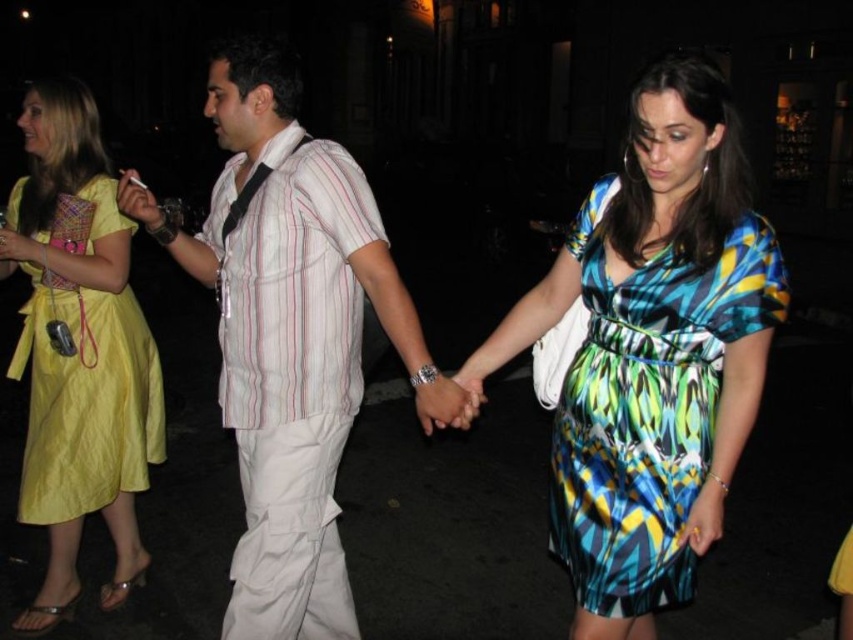
Question: Considering the real-world distances, which object is closest to the matte black cigarette at center?

Choices:
 (A) printed silk dress at center
 (B) white striped shirt at center

Answer: (B)

Question: In this image, where is printed silk dress at center located relative to matte black cigarette at center?

Choices:
 (A) above
 (B) below

Answer: (B)

Question: Based on their relative distances, which object is nearer to the printed silk dress at center?

Choices:
 (A) matte black cigarette at center
 (B) white striped shirt at center
 (C) yellow satin dress at left

Answer: (B)

Question: Does white striped shirt at center come in front of printed silk dress at center?

Choices:
 (A) yes
 (B) no

Answer: (B)

Question: Which point is farther to the camera?

Choices:
 (A) yellow satin dress at left
 (B) printed silk dress at center

Answer: (A)

Question: Observing the image, what is the correct spatial positioning of printed silk dress at center in reference to yellow satin dress at left?

Choices:
 (A) above
 (B) below

Answer: (B)